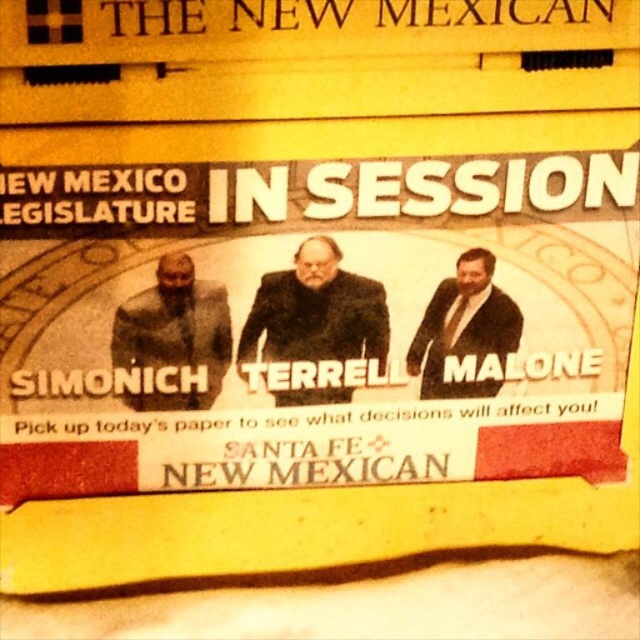
Can you confirm if matte black suit at center is shorter than matte black suit at right?

No.

The image size is (640, 640). What do you see at coordinates (173, 332) in the screenshot?
I see `matte black suit at center` at bounding box center [173, 332].

Does point (188, 266) come farther from viewer compared to point (461, 330)?

No, it is in front of (461, 330).

Where is `matte black suit at center`? This screenshot has width=640, height=640. matte black suit at center is located at coordinates (173, 332).

The width and height of the screenshot is (640, 640). Identify the location of dark brown suit at center. (316, 310).

Consider the image. Between dark brown suit at center and matte black suit at center, which one is positioned lower?

matte black suit at center is lower down.

The width and height of the screenshot is (640, 640). What do you see at coordinates (316, 310) in the screenshot?
I see `dark brown suit at center` at bounding box center [316, 310].

Locate an element on the screen. dark brown suit at center is located at coordinates (316, 310).

Between dark brown suit at center and matte black suit at right, which one has more height?

Standing taller between the two is dark brown suit at center.

Image resolution: width=640 pixels, height=640 pixels. What do you see at coordinates (316, 310) in the screenshot?
I see `dark brown suit at center` at bounding box center [316, 310].

Image resolution: width=640 pixels, height=640 pixels. I want to click on dark brown suit at center, so click(x=316, y=310).